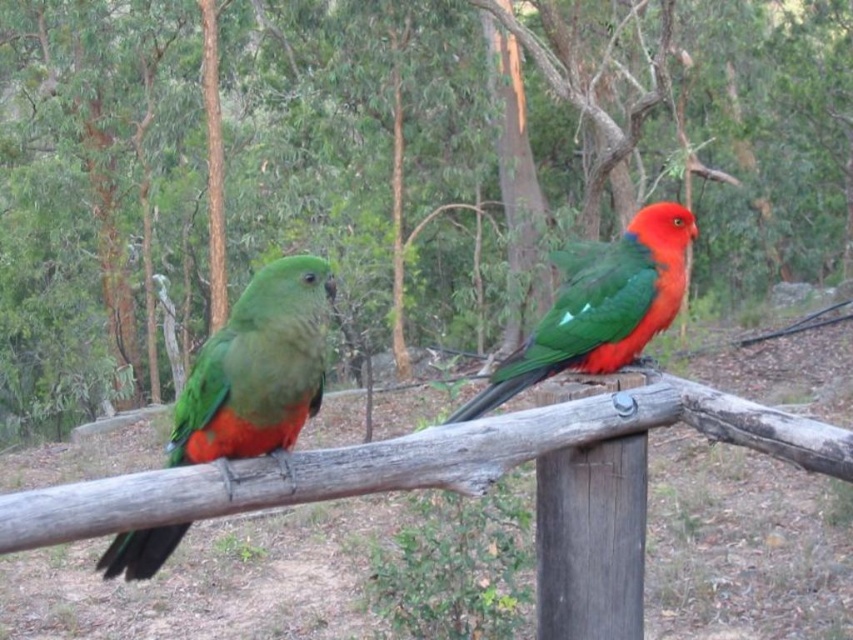
You are a birdwatcher standing in front of the green wood tree at center and the shiny green parrot at center. Which object is closer to you?

The green wood tree at center is closer to you than the shiny green parrot at center because it is positioned further away from the viewer.

You are standing at the point labeled as point (590, 540) in the image. What object are you directly facing?

The wooden post at center is located at point (590, 540), so you are directly facing the wooden post at center.

You are a birdwatcher trying to spot both parrots from a distance. Which object, the green wood tree at center or the wooden post at center, would block your view of the parrots if you stand behind it?

The green wood tree at center is much taller than the wooden post at center, so standing behind the green wood tree at center would block your view of the parrots more effectively than the wooden post at center.